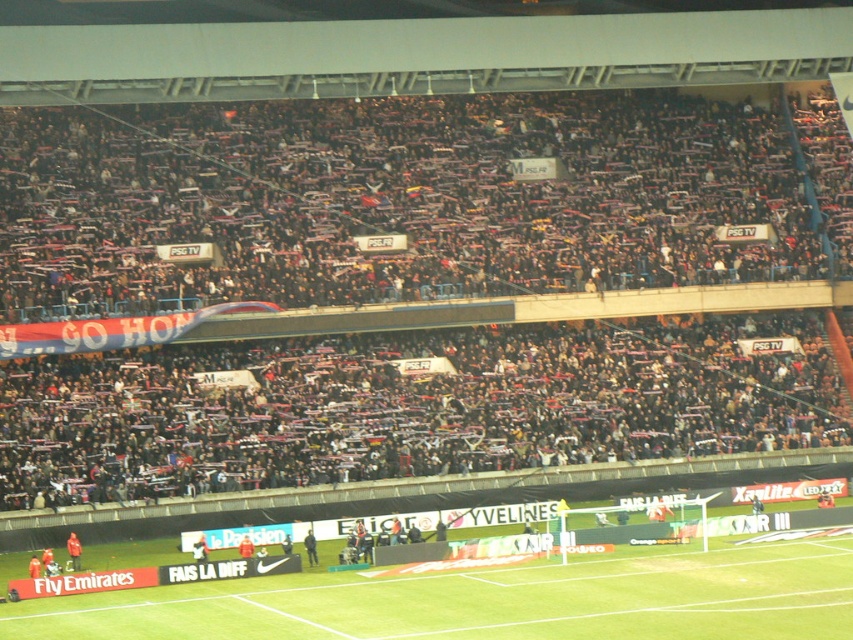
How much distance is there between dark blue jersey at center and orange jersey at center?

The distance of dark blue jersey at center from orange jersey at center is 3.93 feet.

Describe the element at coordinates (310, 547) in the screenshot. This screenshot has width=853, height=640. I see `dark blue jersey at center` at that location.

Is point (306, 548) positioned after point (242, 541)?

No.

Where is `dark blue jersey at center`? The height and width of the screenshot is (640, 853). dark blue jersey at center is located at coordinates (310, 547).

In the scene shown: Does green fabric jacket at lower center have a greater width compared to dark blue jersey at center?

Correct, the width of green fabric jacket at lower center exceeds that of dark blue jersey at center.

Who is more forward, (74, 568) or (308, 532)?

Point (74, 568) is more forward.

You are a GUI agent. You are given a task and a screenshot of the screen. Output one action in this format:
    pyautogui.click(x=<x>, y=<y>)
    Task: Click on the green fabric jacket at lower center
    
    Given the screenshot: What is the action you would take?
    coord(74,550)

Measure the distance between point (666, 579) and camera.

The distance of point (666, 579) from camera is 51.34 meters.

Does green grass football field at lower center have a lesser height compared to dark blue jersey at center?

No.

What do you see at coordinates (491, 600) in the screenshot?
I see `green grass football field at lower center` at bounding box center [491, 600].

This screenshot has height=640, width=853. What are the coordinates of `green grass football field at lower center` in the screenshot? It's located at (491, 600).